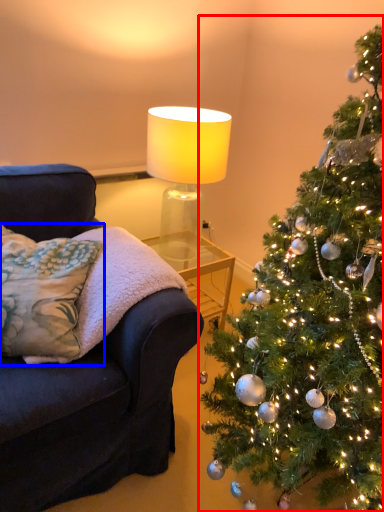
Question: Which point is further to the camera, christmas tree (highlighted by a red box) or pillow (highlighted by a blue box)?

Choices:
 (A) christmas tree
 (B) pillow

Answer: (B)